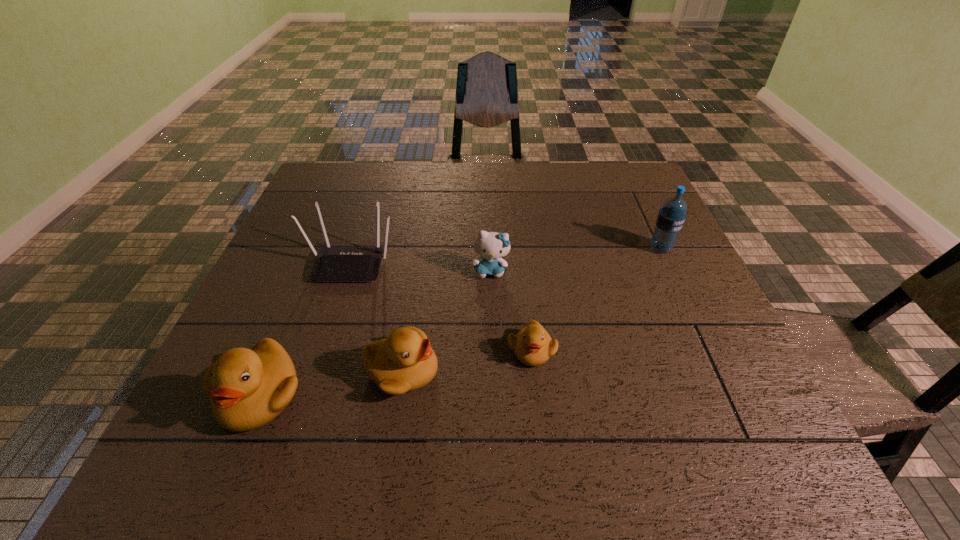
In the image, there is a desktop. Where is `vacant space at the right edge`? vacant space at the right edge is located at coordinates click(x=638, y=298).

Locate an element on the screen. The height and width of the screenshot is (540, 960). vacant area at the far left corner is located at coordinates (363, 181).

Where is `free space between the water bottle and the rightmost duckling`? free space between the water bottle and the rightmost duckling is located at coordinates (596, 299).

At what (x,y) coordinates should I click in order to perform the action: click on vacant area that lies between the second shortest duckling and the kitten. Please return your answer as a coordinate pair (x, y). Looking at the image, I should click on (446, 321).

Identify the location of free point between the water bottle and the rightmost duckling. (596, 299).

In order to click on vacant area between the rightmost duckling and the router in this screenshot , I will do 442,306.

Where is `empty space that is in between the kitten and the leftmost duckling`? The height and width of the screenshot is (540, 960). empty space that is in between the kitten and the leftmost duckling is located at coordinates (375, 333).

Identify the location of vacant region between the tallest object and the kitten. (575, 260).

You are a GUI agent. You are given a task and a screenshot of the screen. Output one action in this format:
    pyautogui.click(x=<x>, y=<y>)
    Task: Click on the empty space that is in between the kitten and the water bottle
    The width and height of the screenshot is (960, 540).
    Given the screenshot: What is the action you would take?
    pyautogui.click(x=575, y=260)

The image size is (960, 540). I want to click on empty space that is in between the kitten and the shortest duckling, so click(511, 310).